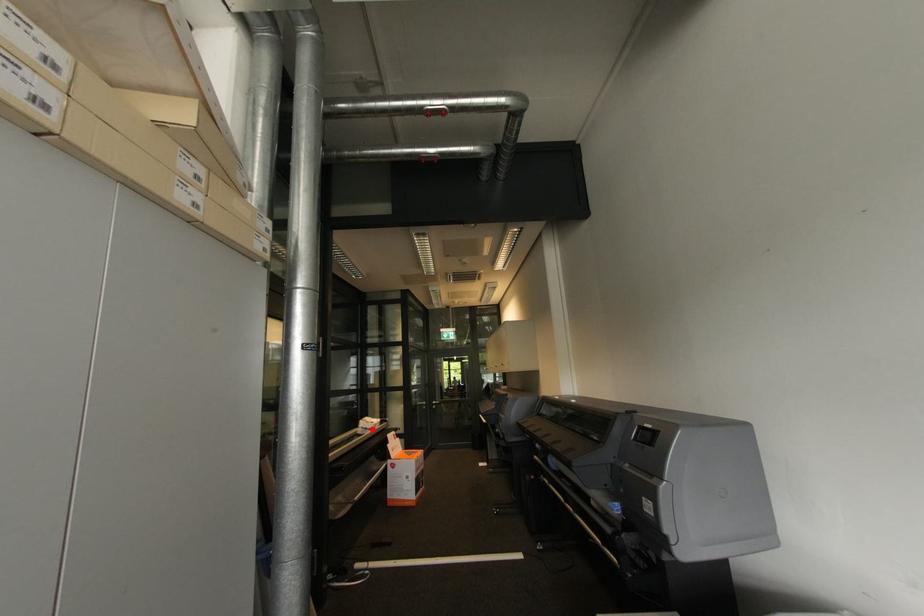
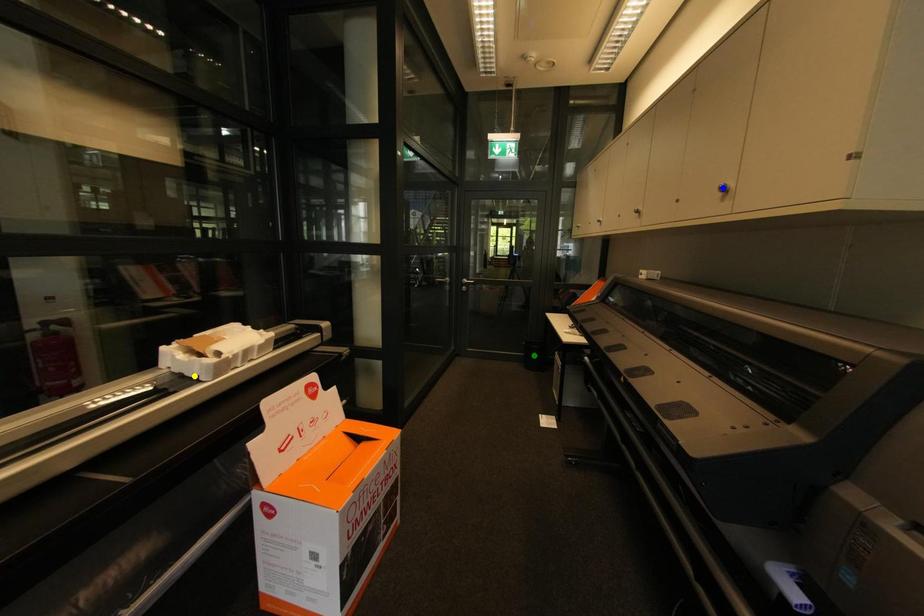
Question: I am providing you with two images of the same scene from different viewpoints. A red point is marked on the first image. You are given multiple points on the second image. Which point in image 2 is actually the same real-world point as the red point in image 1?

Choices:
 (A) yellow point
 (B) green point
 (C) blue point

Answer: (A)